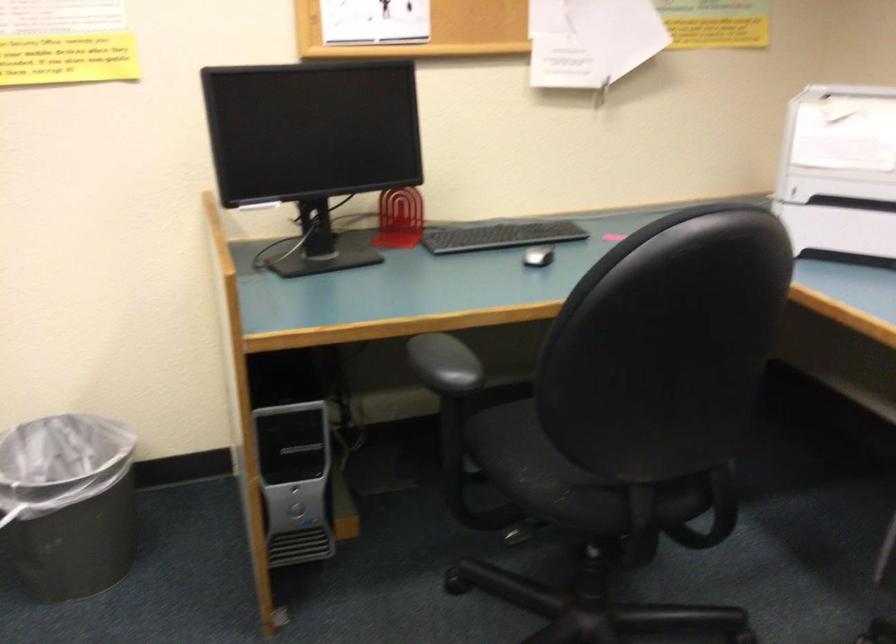
Locate an element on the screen. gray trash can is located at coordinates (67, 504).